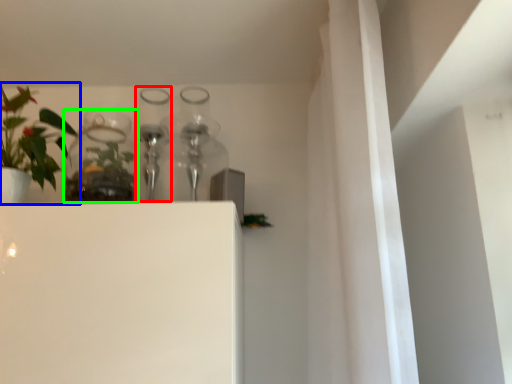
Question: Considering the real-world distances, which object is closest to bottle (highlighted by a red box)? houseplant (highlighted by a blue box) or glass vase (highlighted by a green box).

Choices:
 (A) houseplant
 (B) glass vase

Answer: (B)